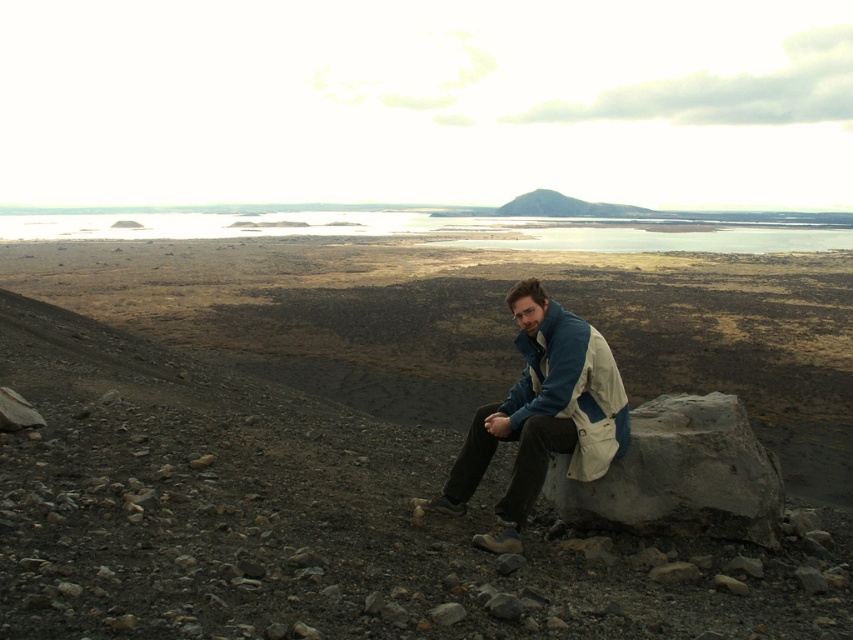
Which is in front, point (575, 497) or point (527, 353)?

Point (575, 497) is in front.

Who is higher up, gray rough rock at lower right or blue/white fabric jacket at center?

blue/white fabric jacket at center is higher up.

Does point (778, 477) come behind point (560, 394)?

Yes.

You are a GUI agent. You are given a task and a screenshot of the screen. Output one action in this format:
    pyautogui.click(x=<x>, y=<y>)
    Task: Click on the gray rough rock at lower right
    
    Given the screenshot: What is the action you would take?
    pyautogui.click(x=679, y=476)

Is gray gravel at center to the left of gray rough rock at lower right from the viewer's perspective?

No, gray gravel at center is not to the left of gray rough rock at lower right.

This screenshot has height=640, width=853. I want to click on gray gravel at center, so click(x=376, y=433).

I want to click on gray gravel at center, so click(376, 433).

Looking at this image, does gray gravel at center appear under blue/white fabric jacket at center?

Actually, gray gravel at center is above blue/white fabric jacket at center.

Does gray gravel at center have a lesser width compared to blue/white fabric jacket at center?

Incorrect, gray gravel at center's width is not less than blue/white fabric jacket at center's.

The width and height of the screenshot is (853, 640). Identify the location of gray gravel at center. (376, 433).